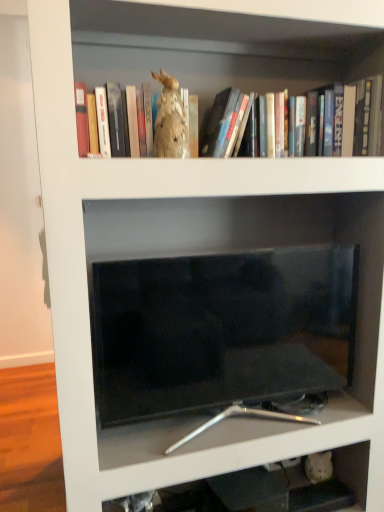
Where is `vacant region below black glossy tv at center (from a real-world perspective)`? The width and height of the screenshot is (384, 512). vacant region below black glossy tv at center (from a real-world perspective) is located at coordinates (246, 428).